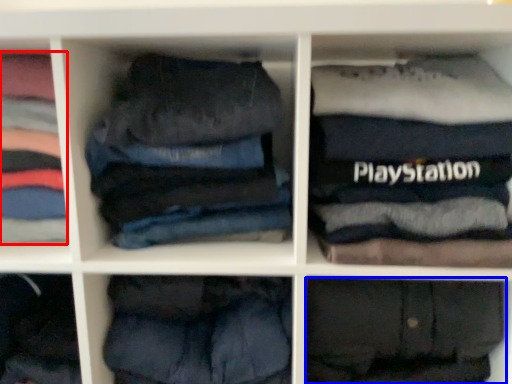
Question: Among these objects, which one is farthest to the camera, clothing (highlighted by a red box) or trousers (highlighted by a blue box)?

Choices:
 (A) clothing
 (B) trousers

Answer: (A)